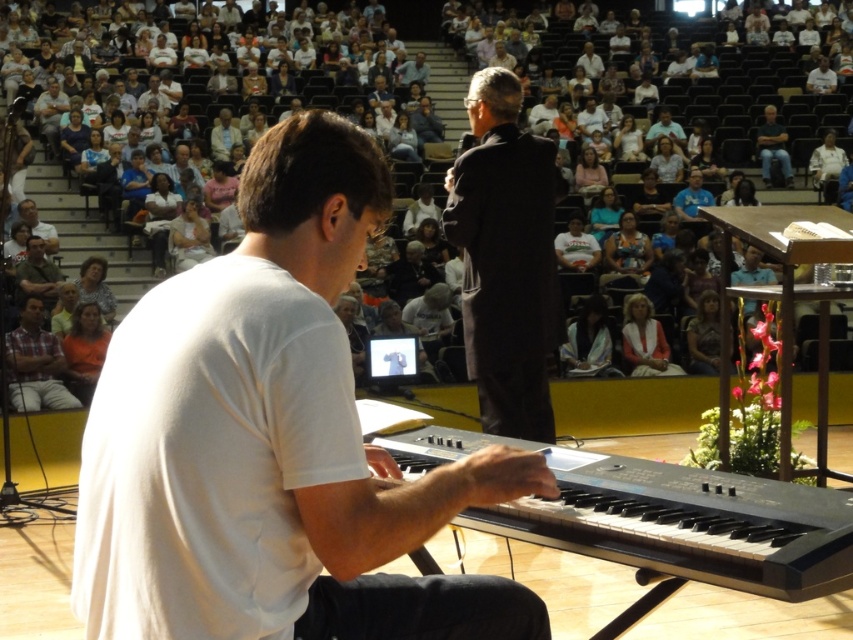
Question: Does striped fabric jacket at center come behind light brown hair at lower left?

Choices:
 (A) no
 (B) yes

Answer: (B)

Question: Is matte black laptop at center smaller than light blue shirt at center?

Choices:
 (A) yes
 (B) no

Answer: (A)

Question: Which point is closer to the camera?

Choices:
 (A) (598, 166)
 (B) (573, 356)
 (C) (659, 340)

Answer: (B)

Question: Which point is closer to the camera taking this photo?

Choices:
 (A) (813, 168)
 (B) (192, 212)
 (C) (780, 157)
 (D) (607, 244)

Answer: (B)

Question: Considering the relative positions of light blue shirt at center and light brown hair at upper left in the image provided, where is light blue shirt at center located with respect to light brown hair at upper left?

Choices:
 (A) right
 (B) left

Answer: (A)

Question: Which point appears closest to the camera in this image?

Choices:
 (A) (233, 125)
 (B) (787, 160)

Answer: (A)